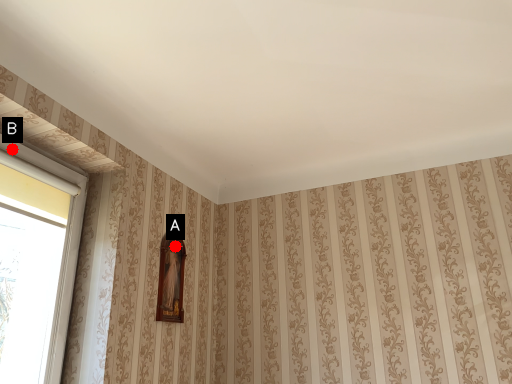
Question: Two points are circled on the image, labeled by A and B beside each circle. Which point appears farthest from the camera in this image?

Choices:
 (A) A is further
 (B) B is further

Answer: (A)